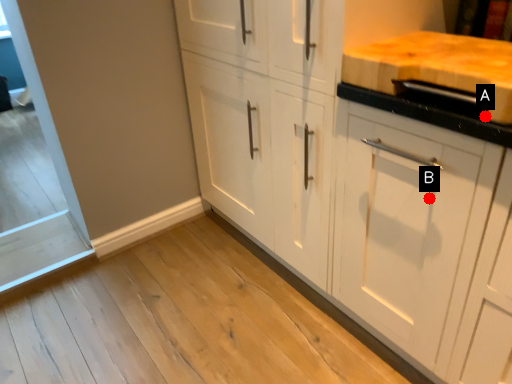
Question: Two points are circled on the image, labeled by A and B beside each circle. Which point is further to the camera?

Choices:
 (A) A is further
 (B) B is further

Answer: (B)